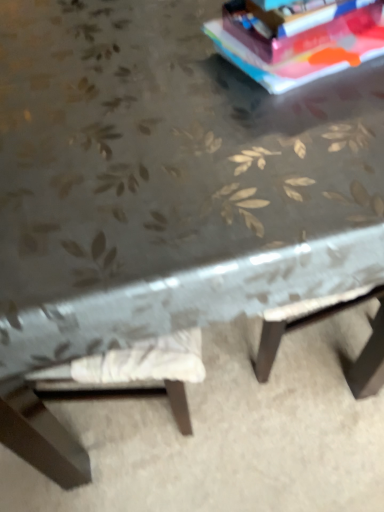
Identify the location of white fabric cushion at lower left. (229, 433).

This screenshot has width=384, height=512. What do you see at coordinates (229, 433) in the screenshot? I see `white fabric cushion at lower left` at bounding box center [229, 433].

The height and width of the screenshot is (512, 384). Describe the element at coordinates (297, 27) in the screenshot. I see `matte paper at upper right` at that location.

Measure the distance between matte paper at upper right and camera.

The distance of matte paper at upper right from camera is 28.35 inches.

Locate an element on the screen. The height and width of the screenshot is (512, 384). matte paper at upper right is located at coordinates (297, 27).

The width and height of the screenshot is (384, 512). I want to click on white fabric cushion at lower left, so click(229, 433).

Consider the image. Would you say white fabric cushion at lower left is to the left or to the right of matte paper at upper right in the picture?

Clearly, white fabric cushion at lower left is on the left of matte paper at upper right in the image.

Relative to matte paper at upper right, is white fabric cushion at lower left in front or behind?

white fabric cushion at lower left is positioned farther from the viewer than matte paper at upper right.

Does point (49, 489) come behind point (274, 58)?

Yes, it is behind point (274, 58).

From the image's perspective, between white fabric cushion at lower left and matte paper at upper right, who is located below?

white fabric cushion at lower left, from the image's perspective.

From a real-world perspective, between white fabric cushion at lower left and matte paper at upper right, who is vertically lower?

In real-world perspective, white fabric cushion at lower left is lower.

Which of these two, white fabric cushion at lower left or matte paper at upper right, is wider?

white fabric cushion at lower left.

From the picture: Does white fabric cushion at lower left have a lesser height compared to matte paper at upper right?

Yes.

Which of these two, white fabric cushion at lower left or matte paper at upper right, is bigger?

white fabric cushion at lower left.

Can we say white fabric cushion at lower left lies outside matte paper at upper right?

Absolutely, white fabric cushion at lower left is external to matte paper at upper right.

Is white fabric cushion at lower left touching matte paper at upper right?

No.

Is white fabric cushion at lower left facing towards matte paper at upper right?

No, white fabric cushion at lower left is not facing towards matte paper at upper right.

Based on the photo, how different are the orientations of white fabric cushion at lower left and matte paper at upper right in degrees?

They differ by 171 degrees in their facing directions.

The height and width of the screenshot is (512, 384). Identify the location of paperback book that appears in front of the white fabric cushion at lower left. (297, 27).

Between matte paper at upper right and white fabric cushion at lower left, which one appears on the left side from the viewer's perspective?

Positioned to the left is white fabric cushion at lower left.

Is matte paper at upper right positioned before white fabric cushion at lower left?

Yes, matte paper at upper right is closer to the viewer.

Which is nearer, (270, 19) or (211, 455)?

Point (270, 19).

From the image's perspective, which is above, matte paper at upper right or white fabric cushion at lower left?

matte paper at upper right appears higher in the image.

From a real-world perspective, relative to white fabric cushion at lower left, is matte paper at upper right vertically above or below?

matte paper at upper right is situated higher than white fabric cushion at lower left in the real world.

Which of these two, matte paper at upper right or white fabric cushion at lower left, is wider?

white fabric cushion at lower left.

Can you confirm if matte paper at upper right is shorter than white fabric cushion at lower left?

No, matte paper at upper right is not shorter than white fabric cushion at lower left.

Does matte paper at upper right have a larger size compared to white fabric cushion at lower left?

Incorrect, matte paper at upper right is not larger than white fabric cushion at lower left.

Is white fabric cushion at lower left surrounded by matte paper at upper right?

No, white fabric cushion at lower left is not inside matte paper at upper right.

Is matte paper at upper right far away from white fabric cushion at lower left?

That's not correct — matte paper at upper right is a little close to white fabric cushion at lower left.

Is matte paper at upper right oriented away from white fabric cushion at lower left?

No, matte paper at upper right is not facing away from white fabric cushion at lower left.

Find the location of `paperback book above the white fabric cushion at lower left (from a real-world perspective)`. paperback book above the white fabric cushion at lower left (from a real-world perspective) is located at coordinates (297, 27).

Find the location of `concrete below the matte paper at upper right (from a real-world perspective)`. concrete below the matte paper at upper right (from a real-world perspective) is located at coordinates (229, 433).

Image resolution: width=384 pixels, height=512 pixels. Find the location of `paperback book in front of the white fabric cushion at lower left`. paperback book in front of the white fabric cushion at lower left is located at coordinates (297, 27).